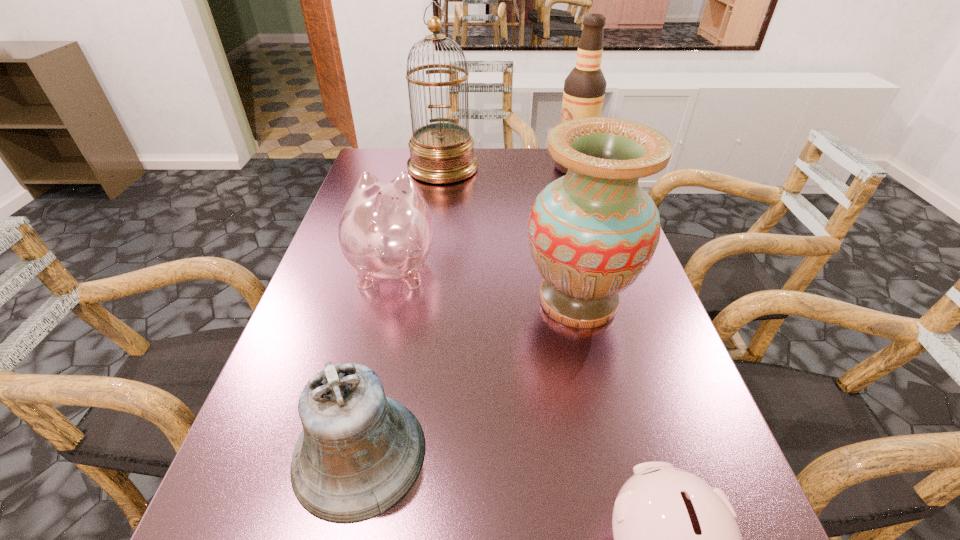
Identify the location of birdcage. (440, 152).

Where is `alcohol`? The image size is (960, 540). alcohol is located at coordinates (584, 88).

Identify the location of vase. The image size is (960, 540). (592, 233).

Locate an element on the screen. the farther piggy bank is located at coordinates [386, 229].

At what (x,y) coordinates should I click in order to perform the action: click on the left piggy bank. Please return your answer as a coordinate pair (x, y). This screenshot has width=960, height=540. Looking at the image, I should click on [386, 229].

Where is `bell`? bell is located at coordinates (360, 452).

Where is `free space located 0.270m with an open door on the birdcage`? The image size is (960, 540). free space located 0.270m with an open door on the birdcage is located at coordinates (433, 240).

Locate an element on the screen. free space located 0.130m on the label of the alcohol is located at coordinates (513, 167).

Where is `vacant space positioned on the label of the alcohol`? vacant space positioned on the label of the alcohol is located at coordinates (496, 167).

What are the coordinates of `vacant space located 0.280m on the label of the alcohol` in the screenshot? It's located at (465, 167).